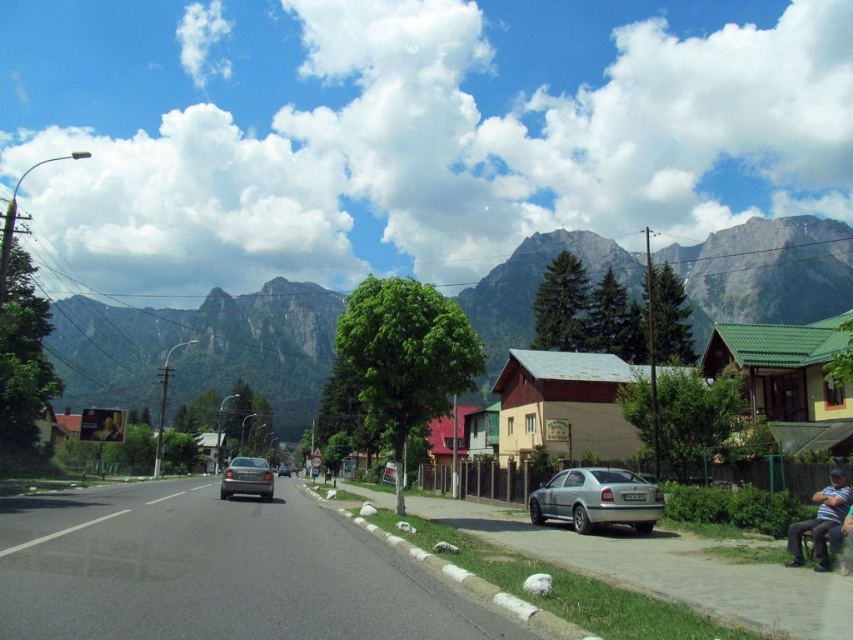
Can you confirm if green rocky mountain at upper center is smaller than silver metallic sedan at center-right?

No.

Which of these two, green rocky mountain at upper center or silver metallic sedan at center-right, stands taller?

Standing taller between the two is green rocky mountain at upper center.

You are a GUI agent. You are given a task and a screenshot of the screen. Output one action in this format:
    pyautogui.click(x=<x>, y=<y>)
    Task: Click on the green rocky mountain at upper center
    The height and width of the screenshot is (640, 853).
    Given the screenshot: What is the action you would take?
    pyautogui.click(x=201, y=348)

Find the location of a particular element. green rocky mountain at upper center is located at coordinates (201, 348).

Does satin silver sedan at center have a smaller size compared to silver metallic sedan at center?

No, satin silver sedan at center is not smaller than silver metallic sedan at center.

Who is taller, satin silver sedan at center or silver metallic sedan at center?

satin silver sedan at center

Image resolution: width=853 pixels, height=640 pixels. What do you see at coordinates (247, 477) in the screenshot?
I see `satin silver sedan at center` at bounding box center [247, 477].

Image resolution: width=853 pixels, height=640 pixels. Identify the location of satin silver sedan at center. (247, 477).

Does silver metallic sedan at center-right have a larger size compared to satin silver sedan at center?

No, silver metallic sedan at center-right is not bigger than satin silver sedan at center.

The width and height of the screenshot is (853, 640). In order to click on silver metallic sedan at center-right in this screenshot , I will do `click(596, 499)`.

The image size is (853, 640). I want to click on silver metallic sedan at center-right, so click(x=596, y=499).